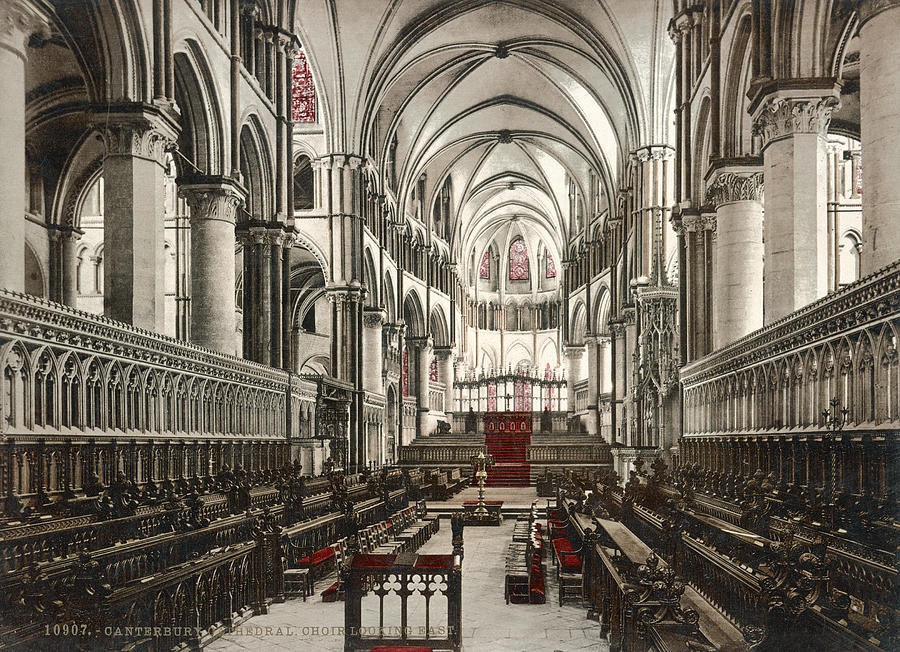
This screenshot has width=900, height=652. Find the location of `benches`. benches is located at coordinates (191, 591).